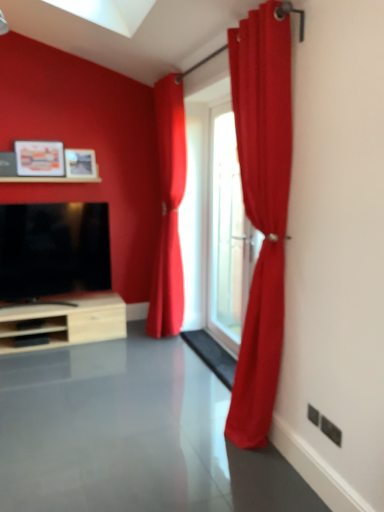
Identify the location of vacant region to the left of satin red curtain at center, placed as the first curtain when sorted from back to front. (137, 336).